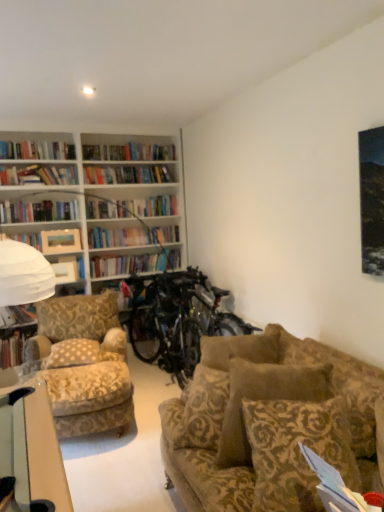
Where is `matte wooden picture frame at upper left, which appears as the 2th picture frame when ordered from the bottom`? The height and width of the screenshot is (512, 384). matte wooden picture frame at upper left, which appears as the 2th picture frame when ordered from the bottom is located at coordinates (60, 241).

The image size is (384, 512). Describe the element at coordinates (14, 345) in the screenshot. I see `hardcover book at left, positioned as the 1th book in bottom-to-top order` at that location.

The width and height of the screenshot is (384, 512). What are the coordinates of `matte white picture frame at upper left, the 2th picture frame from the top` in the screenshot? It's located at (65, 271).

Describe the element at coordinates (335, 487) in the screenshot. This screenshot has height=512, width=384. I see `white paper at lower right` at that location.

Find the location of `matte wooden picture frame at upper left, which ranks as the 1th picture frame in top-to-bottom order`. matte wooden picture frame at upper left, which ranks as the 1th picture frame in top-to-bottom order is located at coordinates (60, 241).

Can you tell me how much beige patterned pillow at center-left, which is the second pillow from right to left, and hardcover book at left, the second book when ordered from top to bottom, differ in facing direction?

The angle between the facing direction of beige patterned pillow at center-left, which is the second pillow from right to left, and the facing direction of hardcover book at left, the second book when ordered from top to bottom, is 14.4 degrees.

Is beige patterned pillow at center-left, the first pillow in the back-to-front sequence, not within hardcover book at left, positioned as the 1th book in bottom-to-top order?

Yes.

Is point (48, 362) closer to viewer compared to point (17, 344)?

Yes, it is.

Is hardcover book at left, positioned as the 1th book in bottom-to-top order, at the back of beige patterned pillow at center-left, marked as the 2th pillow in a front-to-back arrangement?

Yes, beige patterned pillow at center-left, marked as the 2th pillow in a front-to-back arrangement,'s orientation is away from hardcover book at left, positioned as the 1th book in bottom-to-top order.

Would you say white paper at lower right is to the left or to the right of matte white picture frame at upper left, the 2th picture frame from the top, in the picture?

white paper at lower right is to the right of matte white picture frame at upper left, the 2th picture frame from the top.

Can we say white paper at lower right lies outside matte white picture frame at upper left, the 2th picture frame from the top?

Indeed, white paper at lower right is completely outside matte white picture frame at upper left, the 2th picture frame from the top.

Which is behind, point (328, 505) or point (72, 265)?

The point (72, 265) is farther from the camera.

Is matte wooden picture frame at upper left, which ranks as the 1th picture frame in top-to-bottom order, inside white paper at lower right?

No.

In the image, is white paper at lower right positioned in front of or behind matte wooden picture frame at upper left, which appears as the 2th picture frame when ordered from the bottom?

white paper at lower right is in front of matte wooden picture frame at upper left, which appears as the 2th picture frame when ordered from the bottom.

Does white paper at lower right turn towards matte wooden picture frame at upper left, which appears as the 2th picture frame when ordered from the bottom?

No.

Does point (357, 503) come in front of point (74, 234)?

That is True.

From the image's perspective, which is above, metallic silver bicycle at center or matte wooden picture frame at upper left, which appears as the 2th picture frame when ordered from the bottom?

matte wooden picture frame at upper left, which appears as the 2th picture frame when ordered from the bottom, appears higher in the image.

What's the angular difference between metallic silver bicycle at center and matte wooden picture frame at upper left, which ranks as the 1th picture frame in top-to-bottom order,'s facing directions?

89.4 degrees separate the facing orientations of metallic silver bicycle at center and matte wooden picture frame at upper left, which ranks as the 1th picture frame in top-to-bottom order.

Is metallic silver bicycle at center far from matte wooden picture frame at upper left, which appears as the 2th picture frame when ordered from the bottom?

Yes, metallic silver bicycle at center is far from matte wooden picture frame at upper left, which appears as the 2th picture frame when ordered from the bottom.

From the image's perspective, is brown patterned pillow at lower right, the 2th pillow in the left-to-right sequence, below hardcover book at left, placed as the 2th book when sorted from bottom to top?

Indeed, from the image's perspective, brown patterned pillow at lower right, the 2th pillow in the left-to-right sequence, is shown beneath hardcover book at left, placed as the 2th book when sorted from bottom to top.

From a real-world perspective, is brown patterned pillow at lower right, the 2th pillow in the left-to-right sequence, positioned over hardcover book at left, placed as the 2th book when sorted from bottom to top, based on gravity?

Incorrect, from a real-world perspective, brown patterned pillow at lower right, the 2th pillow in the left-to-right sequence, is lower than hardcover book at left, placed as the 2th book when sorted from bottom to top.

Is brown patterned pillow at lower right, the 2th pillow in the left-to-right sequence, next to hardcover book at left, placed as the 2th book when sorted from bottom to top?

No, brown patterned pillow at lower right, the 2th pillow in the left-to-right sequence, is not next to hardcover book at left, placed as the 2th book when sorted from bottom to top.

Would you say matte white picture frame at upper left, acting as the 1th picture frame starting from the bottom, is part of beige patterned pillow at center-left, which is counted as the first pillow, starting from the left,'s contents?

Actually, matte white picture frame at upper left, acting as the 1th picture frame starting from the bottom, is outside beige patterned pillow at center-left, which is counted as the first pillow, starting from the left.

Could you measure the distance between beige patterned pillow at center-left, which is counted as the first pillow, starting from the left, and matte white picture frame at upper left, acting as the 1th picture frame starting from the bottom?

beige patterned pillow at center-left, which is counted as the first pillow, starting from the left, and matte white picture frame at upper left, acting as the 1th picture frame starting from the bottom, are 1.33 meters apart from each other.

Does beige patterned pillow at center-left, which is counted as the first pillow, starting from the left, turn towards matte white picture frame at upper left, the 2th picture frame from the top?

No, beige patterned pillow at center-left, which is counted as the first pillow, starting from the left, is not aimed at matte white picture frame at upper left, the 2th picture frame from the top.

How different are the orientations of beige patterned pillow at center-left, which is counted as the first pillow, starting from the left, and matte white picture frame at upper left, acting as the 1th picture frame starting from the bottom, in degrees?

beige patterned pillow at center-left, which is counted as the first pillow, starting from the left, and matte white picture frame at upper left, acting as the 1th picture frame starting from the bottom, are facing 12.3 degrees away from each other.

Who is bigger, hardcover book at left, the second book when ordered from top to bottom, or brown patterned pillow at lower right, marked as the 1th pillow in a front-to-back arrangement?

brown patterned pillow at lower right, marked as the 1th pillow in a front-to-back arrangement.

Do you think hardcover book at left, the second book when ordered from top to bottom, is within brown patterned pillow at lower right, the 2th pillow in the left-to-right sequence, or outside of it?

hardcover book at left, the second book when ordered from top to bottom, is not enclosed by brown patterned pillow at lower right, the 2th pillow in the left-to-right sequence.

Is hardcover book at left, the second book when ordered from top to bottom, to the left or to the right of brown patterned pillow at lower right, the 2th pillow from the back, in the image?

In the image, hardcover book at left, the second book when ordered from top to bottom, appears on the left side of brown patterned pillow at lower right, the 2th pillow from the back.

Is hardcover book at left, the second book when ordered from top to bottom, facing towards brown patterned pillow at lower right, the 2th pillow from the back?

Yes, hardcover book at left, the second book when ordered from top to bottom, is facing brown patterned pillow at lower right, the 2th pillow from the back.

Starting from the hardcover book at left, the second book when ordered from top to bottom, which pillow is the 1st one to the right? Please provide its 2D coordinates.

[(74, 353)]

You are a GUI agent. You are given a task and a screenshot of the screen. Output one action in this format:
    pyautogui.click(x=<x>, y=<y>)
    Task: Click on the paperback book beneath the matte white picture frame at upper left, acting as the 1th picture frame starting from the bottom (from a real-world perspective)
    The height and width of the screenshot is (512, 384).
    Given the screenshot: What is the action you would take?
    pyautogui.click(x=335, y=487)

Which object lies nearer to the anchor point brown patterned pillow at lower right, the 2th pillow from the back, metallic silver bicycle at center or matte wooden picture frame at upper left, which appears as the 2th picture frame when ordered from the bottom?

The object closer to brown patterned pillow at lower right, the 2th pillow from the back, is metallic silver bicycle at center.

From the image, which object appears to be nearer to suede-patterned couch at center, hardcover book at left, placed as the 2th book when sorted from bottom to top, or beige patterned pillow at center-left, the first pillow in the back-to-front sequence?

The object closer to suede-patterned couch at center is beige patterned pillow at center-left, the first pillow in the back-to-front sequence.

Considering their positions, is matte wooden picture frame at upper left, which appears as the 2th picture frame when ordered from the bottom, positioned further to suede-patterned couch at center than brown patterned pillow at lower right, placed as the first pillow when sorted from right to left?

matte wooden picture frame at upper left, which appears as the 2th picture frame when ordered from the bottom.

Looking at the image, which one is located further to hardcover book at left, the second book when ordered from top to bottom, suede-patterned couch at center or beige patterned pillow at center-left, which is the second pillow from right to left?

suede-patterned couch at center is positioned further to the anchor hardcover book at left, the second book when ordered from top to bottom.

Looking at the image, which one is located closer to hardcover book at left, placed as the 2th book when sorted from bottom to top, brown patterned pillow at lower right, marked as the 1th pillow in a front-to-back arrangement, or white paper at lower right?

brown patterned pillow at lower right, marked as the 1th pillow in a front-to-back arrangement, lies closer to hardcover book at left, placed as the 2th book when sorted from bottom to top, than the other object.

Considering their positions, is suede-patterned couch at center positioned further to matte wooden picture frame at upper left, which ranks as the 1th picture frame in top-to-bottom order, than white paper at lower right?

white paper at lower right.

When comparing their distances from brown patterned pillow at lower right, the 2th pillow in the left-to-right sequence, does metallic silver bicycle at center or suede-patterned couch at center seem closer?

suede-patterned couch at center is closer to brown patterned pillow at lower right, the 2th pillow in the left-to-right sequence.

When comparing their distances from matte wooden picture frame at upper left, which ranks as the 1th picture frame in top-to-bottom order, does suede-patterned couch at center or metallic silver bicycle at center seem further?

suede-patterned couch at center lies further to matte wooden picture frame at upper left, which ranks as the 1th picture frame in top-to-bottom order, than the other object.

Find the location of `bicycle between suede-patterned couch at center and hardcover book at left, placed as the 2th book when sorted from bottom to top, from front to back`. bicycle between suede-patterned couch at center and hardcover book at left, placed as the 2th book when sorted from bottom to top, from front to back is located at coordinates (167, 320).

At what (x,y) coordinates should I click in order to perform the action: click on pillow between brown patterned pillow at lower right, placed as the first pillow when sorted from right to left, and matte white picture frame at upper left, the 2th picture frame from the top, along the z-axis. Please return your answer as a coordinate pair (x, y). The width and height of the screenshot is (384, 512). Looking at the image, I should click on (74, 353).

Locate an element on the screen. This screenshot has width=384, height=512. studio couch between white paper at lower right and matte white picture frame at upper left, acting as the 1th picture frame starting from the bottom, from front to back is located at coordinates (247, 419).

Find the location of a particular element. studio couch positioned between brown patterned pillow at lower right, marked as the 1th pillow in a front-to-back arrangement, and matte white picture frame at upper left, acting as the 1th picture frame starting from the bottom, from near to far is located at coordinates (247, 419).